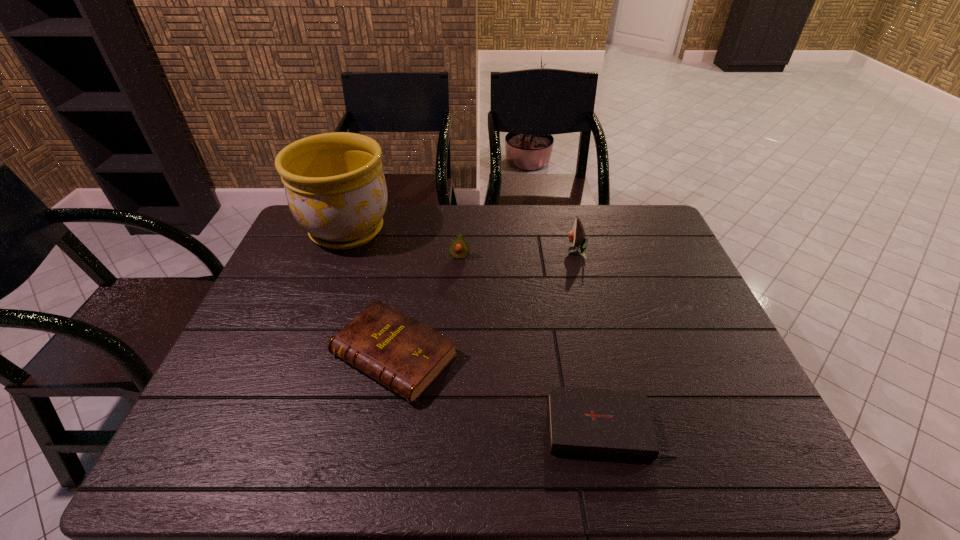
Image resolution: width=960 pixels, height=540 pixels. In order to click on free location at the near edge of the desktop in this screenshot , I will do `click(302, 435)`.

Image resolution: width=960 pixels, height=540 pixels. Identify the location of free space at the left edge of the desktop. (303, 288).

In the image, there is a desktop. Where is `free space at the right edge`? The height and width of the screenshot is (540, 960). free space at the right edge is located at coordinates (652, 264).

Locate an element on the screen. The width and height of the screenshot is (960, 540). free region at the far right corner of the desktop is located at coordinates (627, 224).

The height and width of the screenshot is (540, 960). Find the location of `vacant space at the near right corner of the desktop`. vacant space at the near right corner of the desktop is located at coordinates (733, 434).

Locate an element on the screen. This screenshot has height=540, width=960. free space that is in between the hardback book and the Bible is located at coordinates coord(501,392).

Image resolution: width=960 pixels, height=540 pixels. I want to click on free spot between the shortest object and the tallest object, so click(x=477, y=329).

The height and width of the screenshot is (540, 960). What are the coordinates of `empty space that is in between the shorter avocado and the shortest object` in the screenshot? It's located at (534, 342).

The height and width of the screenshot is (540, 960). Identify the location of empty location between the fourth tallest object and the flowerpot. (371, 293).

Locate an element on the screen. The width and height of the screenshot is (960, 540). empty space between the shortest object and the shorter avocado is located at coordinates (534, 342).